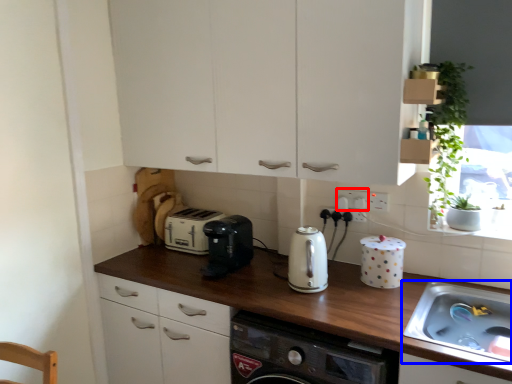
Question: Among these objects, which one is farthest to the camera, electric outlet (highlighted by a red box) or sink (highlighted by a blue box)?

Choices:
 (A) electric outlet
 (B) sink

Answer: (A)